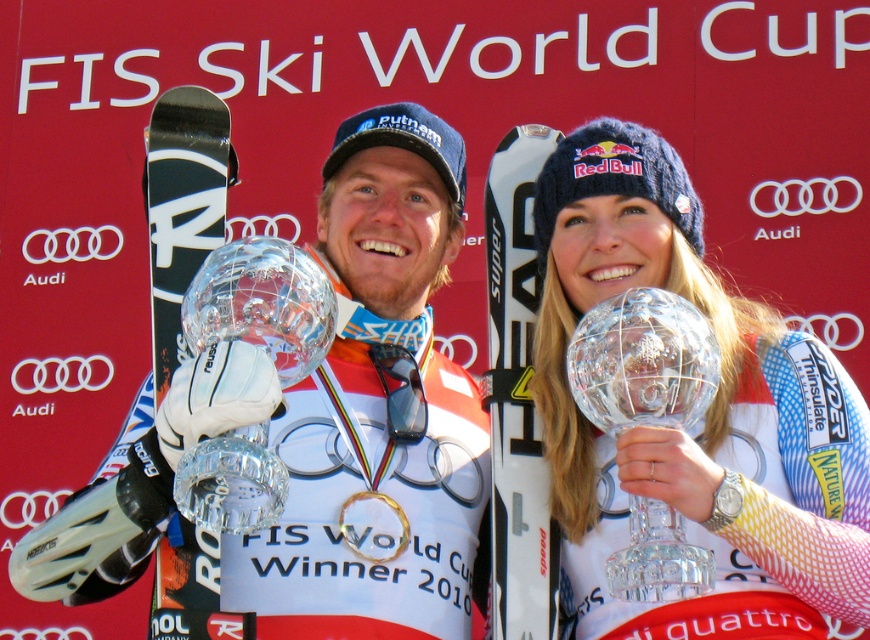
You are a photographer at the FIS Ski World Cup event. You need to capture a photo of both the matte black snowboard at center and the matte white trophy at center in the same frame. The camera you are using has a maximum focus range of 5 meters. Will you be able to include both objects in the photo without moving the camera?

The matte black snowboard at center and matte white trophy at center are 5.78 meters apart from each other. Since the distance between them exceeds the camera maximum focus range of 5 meters, you won

You are a photographer at the FIS Ski World Cup event. You need to position yourself so that both points, point (514, 579) and point (646, 355), are visible in your photo. Given their positions, where should you stand relative to these points to ensure both are in frame?

To ensure both points are visible, you should position yourself in front of point (514, 579) and behind point (646, 355) since point (514, 579) is behind point (646, 355).